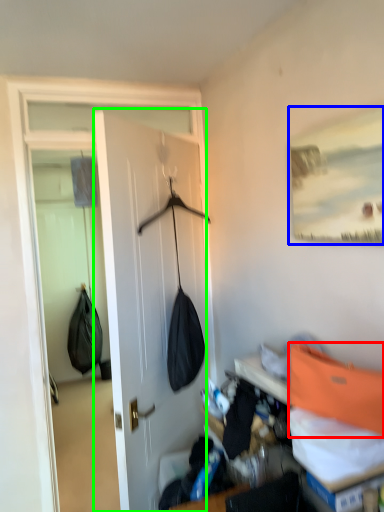
Question: Considering the real-world distances, which object is farthest from shoulder bag (highlighted by a red box)? picture frame (highlighted by a blue box) or door (highlighted by a green box)?

Choices:
 (A) picture frame
 (B) door

Answer: (B)